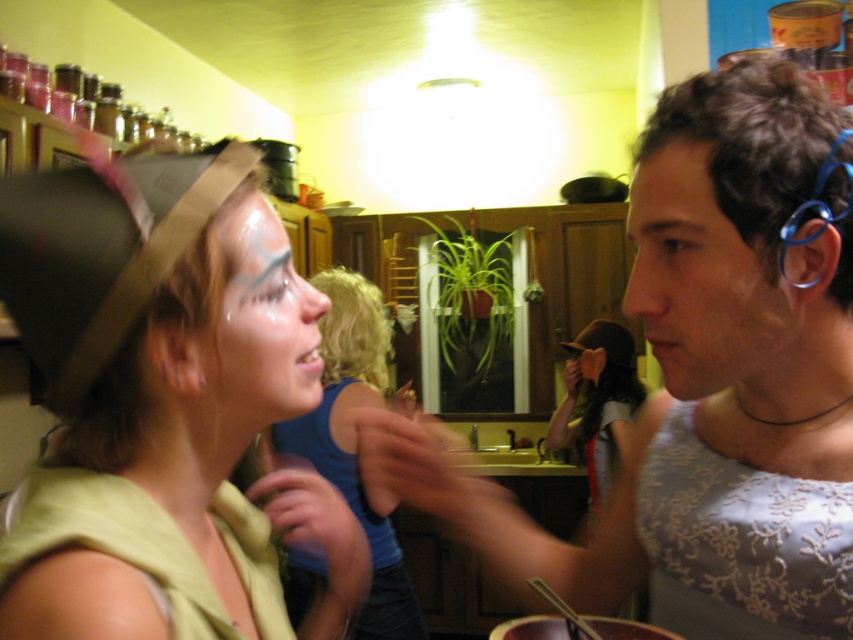
Question: Is matte skin face at center in front of blue fabric shirt at center?

Choices:
 (A) yes
 (B) no

Answer: (A)

Question: Which of the following is the closest to the observer?

Choices:
 (A) (610, 504)
 (B) (250, 209)
 (C) (289, 410)

Answer: (B)

Question: Can you confirm if matte gray tank top at center is positioned to the left of matte green fabric at center?

Choices:
 (A) no
 (B) yes

Answer: (A)

Question: Which of the following is the closest to the observer?

Choices:
 (A) (279, 419)
 (B) (691, 497)
 (C) (389, 627)
 (D) (242, 508)

Answer: (A)

Question: Which point appears closest to the camera in this image?

Choices:
 (A) (648, 163)
 (B) (117, 260)
 (C) (817, 228)
 (D) (276, 419)

Answer: (B)

Question: Does matte gray tank top at center have a greater width compared to matte green fabric at center?

Choices:
 (A) no
 (B) yes

Answer: (B)